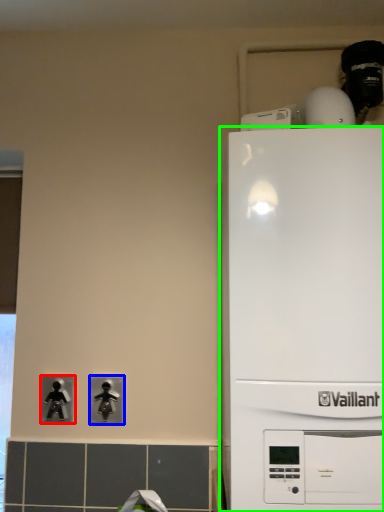
Question: Which is farther away from light switch (highlighted by a red box)? light switch (highlighted by a blue box) or home appliance (highlighted by a green box)?

Choices:
 (A) light switch
 (B) home appliance

Answer: (B)